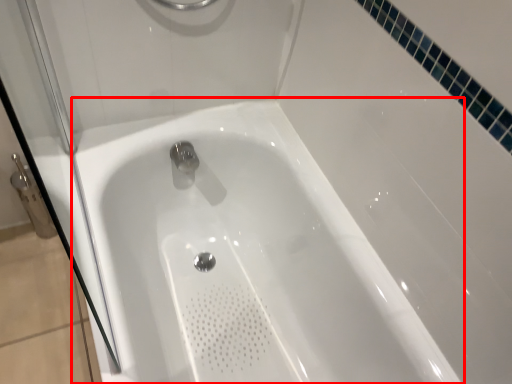
Question: Where is bathtub (annotated by the red box) located in relation to shower door in the image?

Choices:
 (A) right
 (B) left

Answer: (A)